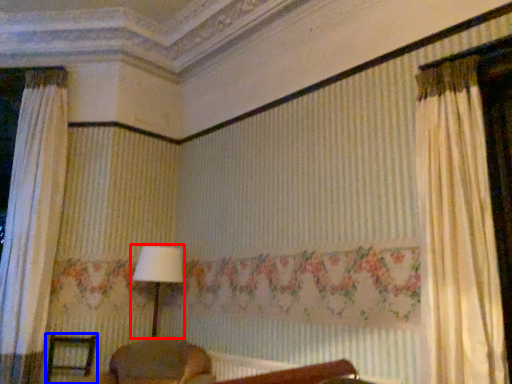
Question: Among these objects, which one is nearest to the camera, table lamp (highlighted by a red box) or furniture (highlighted by a blue box)?

Choices:
 (A) table lamp
 (B) furniture

Answer: (B)